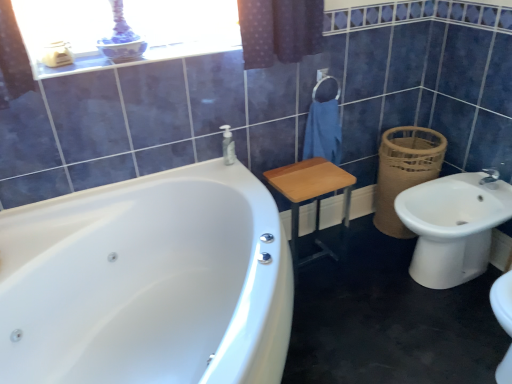
Find the location of a particular element. Image resolution: width=512 pixels, height=384 pixels. vacant region to the left of brown woven basket at right is located at coordinates (362, 235).